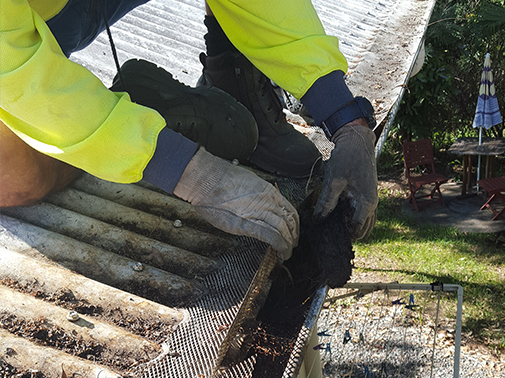
Find the location of a particular element. chair is located at coordinates (429, 184).